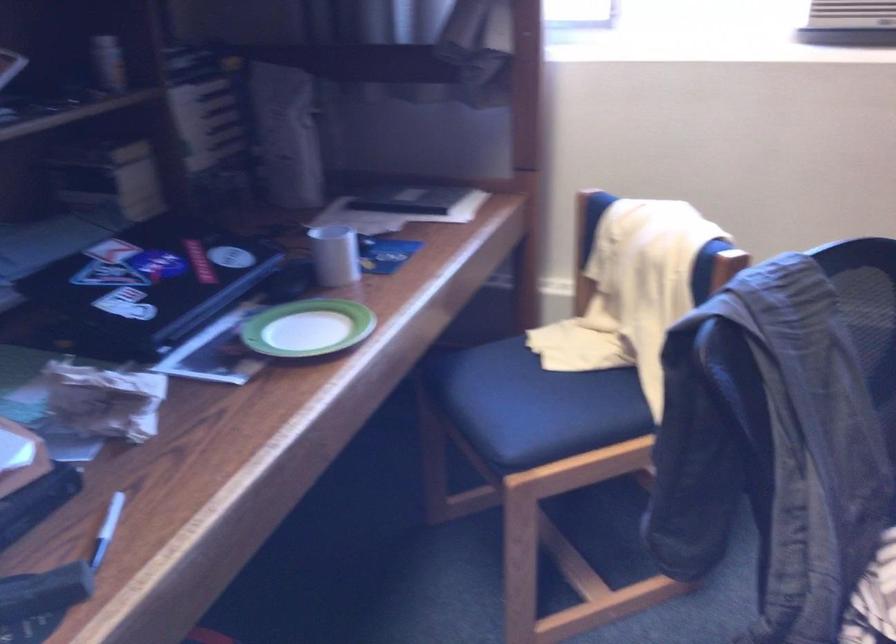
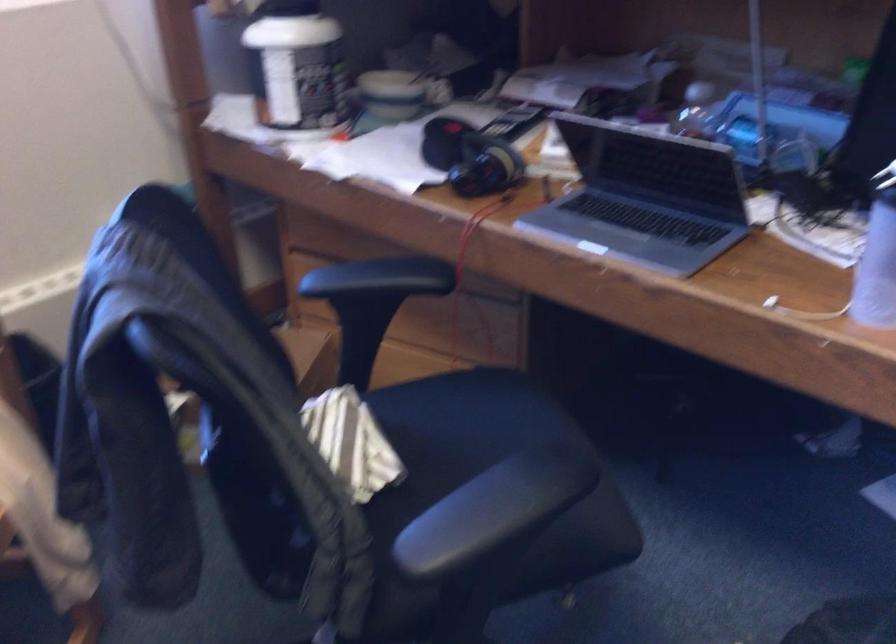
Based on the continuous images, in which direction is the camera rotating?

The camera rotated toward right-down.